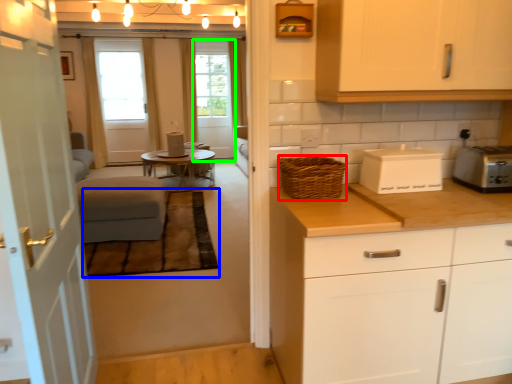
Question: Which object is positioned farthest from basket (highlighted by a red box)? Select from plain (highlighted by a blue box) and screen door (highlighted by a green box).

Choices:
 (A) plain
 (B) screen door

Answer: (B)